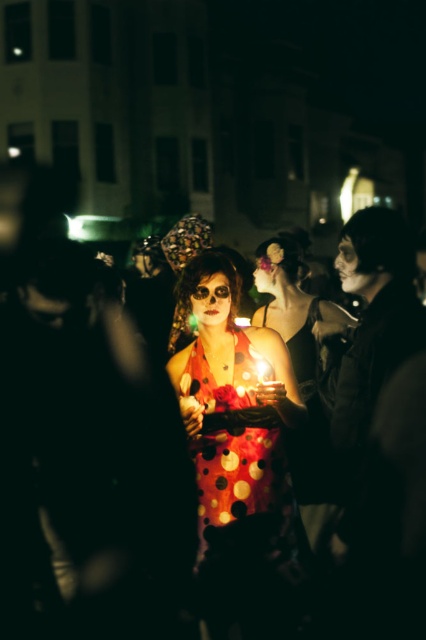
You are a photographer at the event and want to capture the central woman in a closeup shot. The camera lens can only focus on one object at a time. If you want to ensure both the polka dot dress at center and the polka dot fabric dress at center are in focus, which one should you focus on and why?

The polka dot dress at center might be wider than polka dot fabric dress at center, so focusing on the wider one would increase the chances of both being in focus due to depth of field considerations.

You are a photographer at the event and want to capture the woman in the polka dot dress at center and the polka dot fabric dress at center in the same frame. Which one should you position closer to the left side of the camera to ensure both are visible?

The polka dot dress at center is to the left of polka dot fabric dress at center, so positioning the polka dot dress at center closer to the left side of the camera will ensure both are visible in the frame.